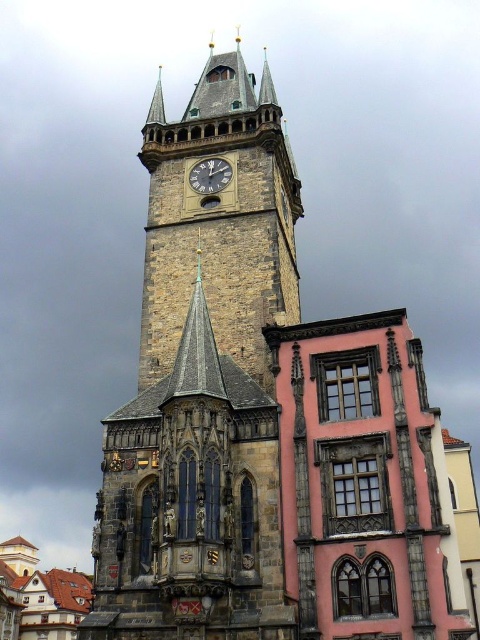
You are an architect analyzing the historic site. You notice the stone clock tower at center and the dark gray stone clock at center. Which of these two structures is larger in size?

The stone clock tower at center is bigger than the dark gray stone clock at center according to the description provided.

You are an architect analyzing the historic site. You observe the stone clock tower at center and the dark gray stone clock at center. Which of these two structures has a greater width?

The stone clock tower at center has a greater width than the dark gray stone clock at center according to the description.

You are standing at the base of the historic stone tower and want to take a photo of the point at coordinates point (208, 225). Your camera has a maximum focus range of 50 meters. Will you be able to focus on the point?

The distance of point (208, 225) from the camera is 55.26 meters, which exceeds the camera maximum focus range of 50 meters. Therefore, the camera cannot focus on the point.